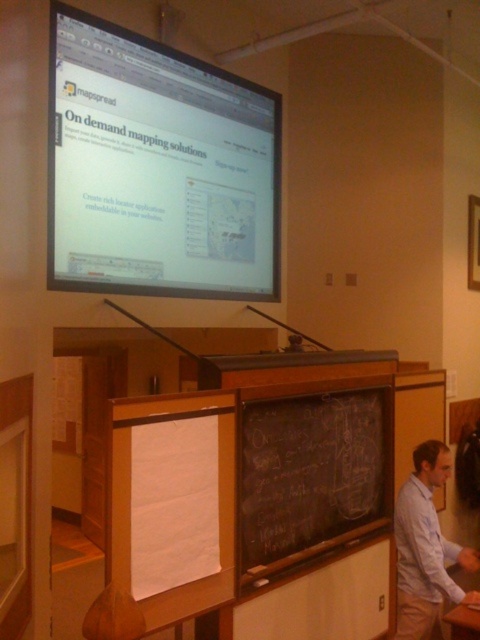
You are standing in the classroom facing the screen. There are two points marked in the image. The first point is at coordinates point (110,156) and the second is at point (377,410). Which point is closer to you?

Point (110,156) is further to the camera than point (377,410), so the second point is closer to you.

You are a speaker preparing to present in the classroom. You need to check if you can see both the matte black screen at upper center and the light blue shirt at lower right from your position at the podium. Based on their positions, can you see both objects clearly?

Yes, the speaker can see both the matte black screen at upper center and the light blue shirt at lower right. The matte black screen at upper center is further to the viewer than the light blue shirt at lower right, so it will be in the foreground, making both visible from the podium.

You are a student sitting at the back of the classroom. You notice a point at coordinate (157,168). What object is located at that coordinate?

The point at coordinate (157,168) indicates the matte black screen at upper center.